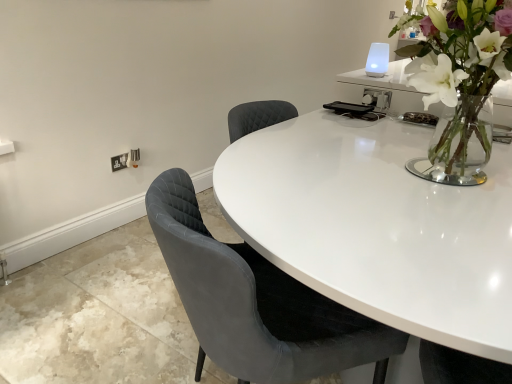
Question: Considering the relative sizes of velvet grey chair at center and white plastic electric outlet at lower left in the image provided, is velvet grey chair at center shorter than white plastic electric outlet at lower left?

Choices:
 (A) yes
 (B) no

Answer: (B)

Question: From a real-world perspective, is velvet grey chair at center below white plastic electric outlet at lower left?

Choices:
 (A) yes
 (B) no

Answer: (B)

Question: Can you confirm if velvet grey chair at center is smaller than white plastic electric outlet at lower left?

Choices:
 (A) yes
 (B) no

Answer: (B)

Question: Is velvet grey chair at center located outside white plastic electric outlet at lower left?

Choices:
 (A) yes
 (B) no

Answer: (A)

Question: Is velvet grey chair at center in front of white plastic electric outlet at lower left?

Choices:
 (A) yes
 (B) no

Answer: (A)

Question: From a real-world perspective, relative to velvet grey chair at center, is white plastic electric outlet at lower left vertically above or below?

Choices:
 (A) above
 (B) below

Answer: (B)

Question: Visually, is white plastic electric outlet at lower left positioned to the left or to the right of velvet grey chair at center?

Choices:
 (A) right
 (B) left

Answer: (B)

Question: Is white plastic electric outlet at lower left spatially inside velvet grey chair at center, or outside of it?

Choices:
 (A) outside
 (B) inside

Answer: (A)

Question: Is point (115, 167) positioned closer to the camera than point (247, 268)?

Choices:
 (A) closer
 (B) farther

Answer: (B)

Question: Is point (433, 38) closer or farther from the camera than point (126, 158)?

Choices:
 (A) closer
 (B) farther

Answer: (A)

Question: Based on their sizes in the image, would you say clear glass vase at upper right is bigger or smaller than white plastic electric outlet at lower left?

Choices:
 (A) big
 (B) small

Answer: (A)

Question: Considering the positions of clear glass vase at upper right and white plastic electric outlet at lower left in the image, is clear glass vase at upper right taller or shorter than white plastic electric outlet at lower left?

Choices:
 (A) short
 (B) tall

Answer: (B)

Question: Is clear glass vase at upper right wider or thinner than white plastic electric outlet at lower left?

Choices:
 (A) thin
 (B) wide

Answer: (B)

Question: In terms of size, does clear glass vase at upper right appear bigger or smaller than velvet grey chair at center?

Choices:
 (A) small
 (B) big

Answer: (A)

Question: Considering the positions of clear glass vase at upper right and velvet grey chair at center in the image, is clear glass vase at upper right wider or thinner than velvet grey chair at center?

Choices:
 (A) thin
 (B) wide

Answer: (A)